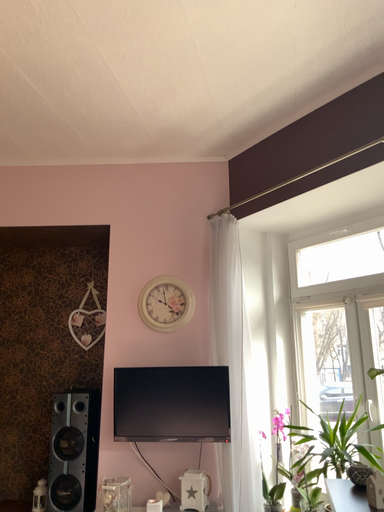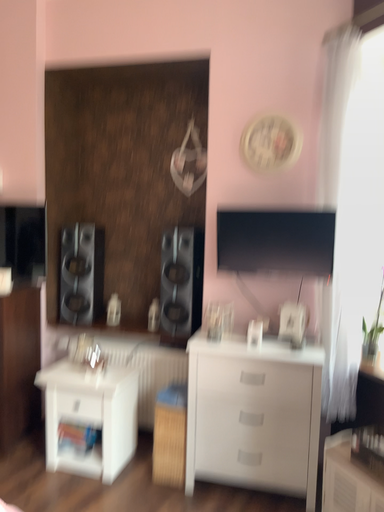
Question: Which way did the camera rotate in the video?

Choices:
 (A) rotated left
 (B) rotated right

Answer: (A)